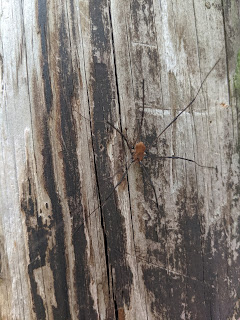
At what (x,y) coordinates should I click in order to perform the action: click on cracks in wood. Please return your answer as a coordinate pair (x, y). Looking at the image, I should click on (98, 185), (130, 184), (115, 309), (114, 69), (225, 42).